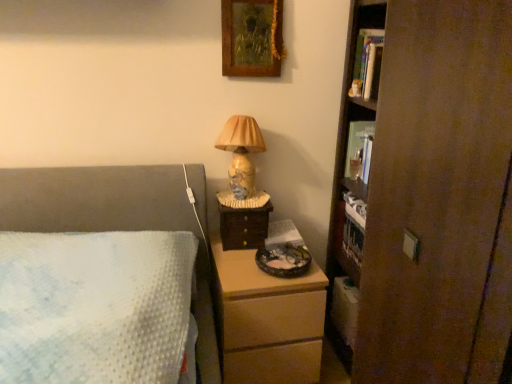
Question: Is matte ceramic lamp at center situated inside white plush cat at upper right or outside?

Choices:
 (A) outside
 (B) inside

Answer: (A)

Question: Based on their positions, is matte ceramic lamp at center located to the left or right of white plush cat at upper right?

Choices:
 (A) left
 (B) right

Answer: (A)

Question: Estimate the real-world distances between objects in this image. Which object is closer to the brown wooden bookcase at right?

Choices:
 (A) hardcover book at upper right, which is the 2th book from front to back
 (B) matte ceramic lamp at center
 (C) white plush cat at upper right
 (D) wooden drawer at right
 (E) wooden chest of drawers at lower center

Answer: (E)

Question: Which object is positioned closest to the wooden picture frame at upper center?

Choices:
 (A) wooden drawer at right
 (B) white plush cat at upper right
 (C) hardcover book at upper right, which ranks as the 1th book in bottom-to-top order
 (D) wooden chest of drawers at lower center
 (E) brown wooden bookcase at right

Answer: (B)